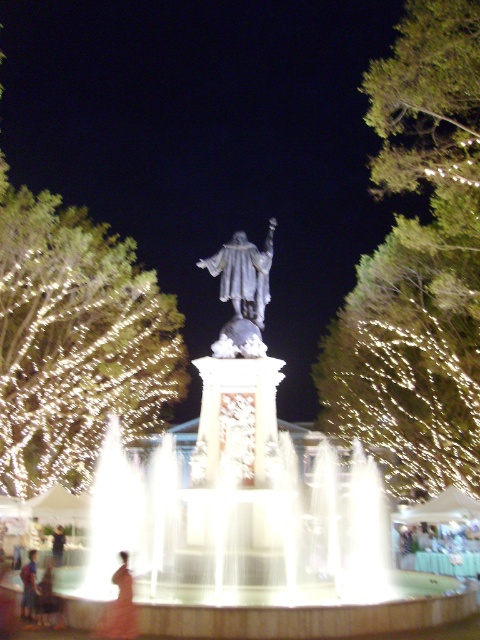
You are a photographer standing at the edge of the fountain area. You want to capture a photo that includes both the satin silver statue at center and the silky orange dress at lower left. Given their sizes, which object should you focus on to ensure both are clearly visible in the frame?

Since the satin silver statue at center is bigger than the silky orange dress at lower left, you should focus on the satin silver statue at center to ensure both are clearly visible in the frame.

You are a photographer setting up a tripod to capture the satin silver statue at center and the silky orange dress at lower left. Based on their heights, which object should you adjust your camera angle to focus on first if you want to ensure both are in frame without moving the tripod?

Since the satin silver statue at center is taller than the silky orange dress at lower left, you should first focus on the satin silver statue at center to ensure its full height is captured, then adjust the angle slightly downward to include the silky orange dress at lower left in the frame.